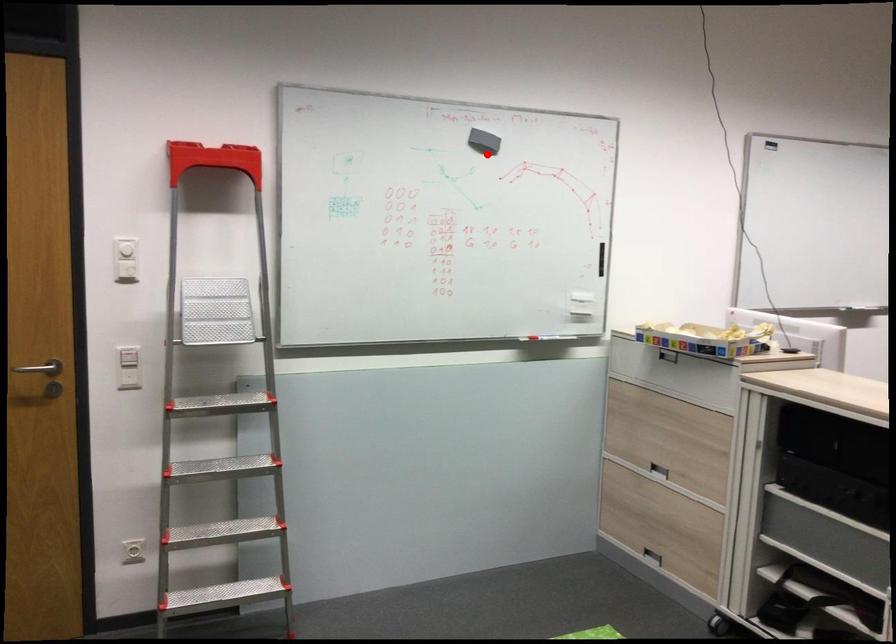
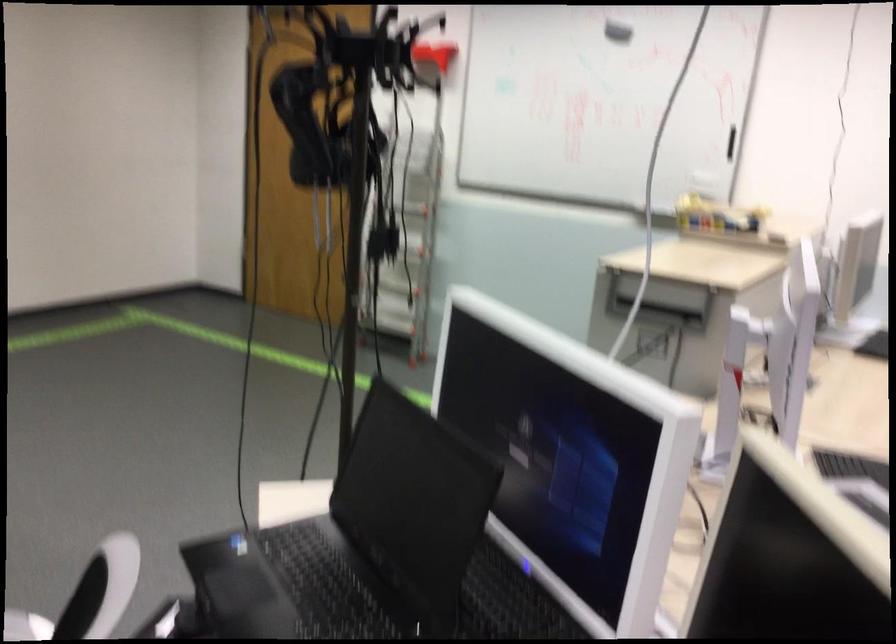
The point at the highlighted location is marked in the first image. Where is the corresponding point in the second image?

(617, 32)